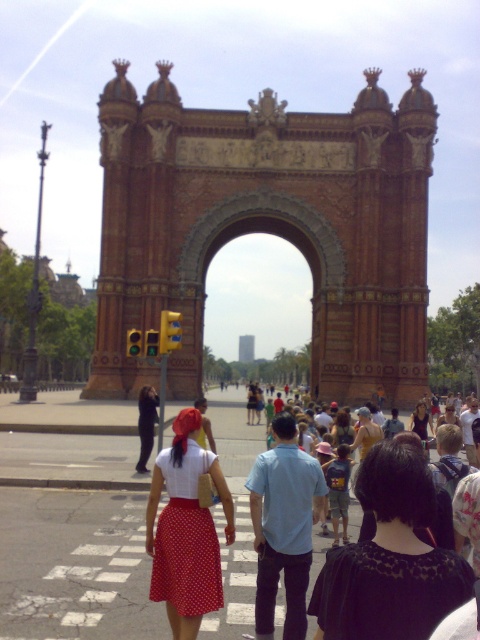
Is light blue shirt at center bigger than red fabric skirt at center?

Indeed, light blue shirt at center has a larger size compared to red fabric skirt at center.

Between light blue shirt at center and red fabric skirt at center, which one appears on the left side from the viewer's perspective?

red fabric skirt at center

Identify the location of light blue shirt at center. The image size is (480, 640). click(284, 525).

Locate an element on the screen. The image size is (480, 640). light blue shirt at center is located at coordinates (284, 525).

Between black lace dress at center and polka dot skirt at center, which one appears on the left side from the viewer's perspective?

Positioned to the left is polka dot skirt at center.

Does black lace dress at center appear under polka dot skirt at center?

Correct, black lace dress at center is located below polka dot skirt at center.

Find the location of a particular element. black lace dress at center is located at coordinates (389, 557).

Who is shorter, black lace dress at center or red fabric skirt at center?

With less height is red fabric skirt at center.

I want to click on black lace dress at center, so click(x=389, y=557).